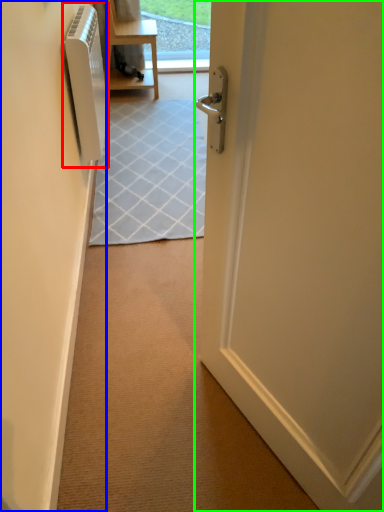
Question: Which object is positioned farthest from air conditioner (highlighted by a red box)? Select from screen door (highlighted by a blue box) and door (highlighted by a green box).

Choices:
 (A) screen door
 (B) door

Answer: (B)